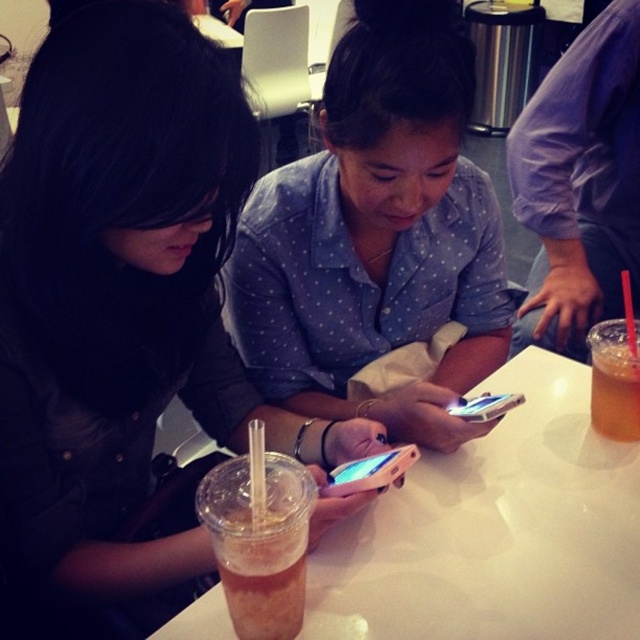
You are a barista trying to reach the transparent plastic straw at upper right from the translucent plastic cup at lower right. Is the straw above or below the cup?

The transparent plastic straw at upper right is above the translucent plastic cup at lower right.

You are a barista who needs to place a new cup on the table without moving the existing items. The table has the translucent plastic cup at lower left and the white plastic smartphone at center. Where should you place the new cup so it doesn

The translucent plastic cup at lower left is located below the white plastic smartphone at center, so placing the new cup to the right or left of the smartphone would avoid overlapping with both existing items.

Based on the photo, you are standing in the room and want to know how far the point at coordinates (253, 445) is from you. Can you determine the distance?

The point at coordinates (253, 445) is 22.93 inches away from you.